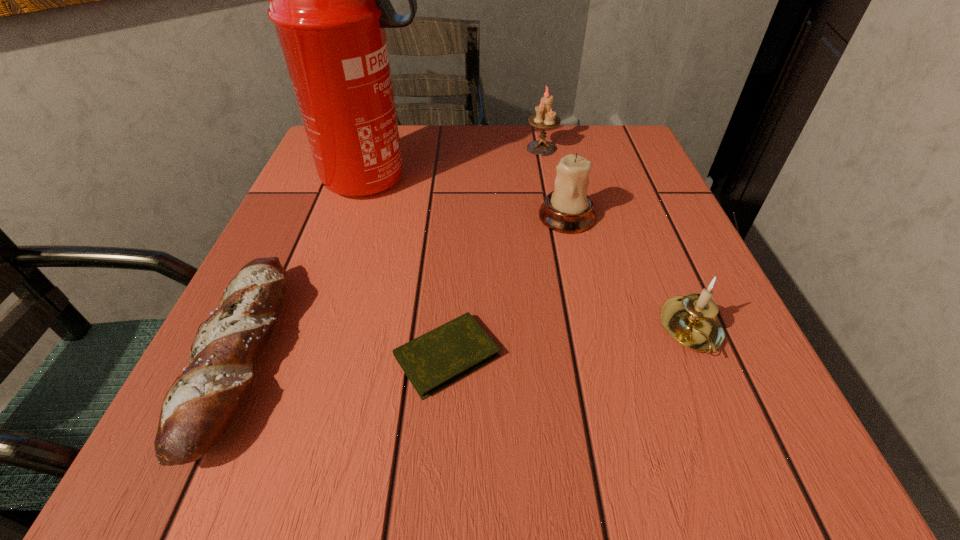
Identify the location of vacant space at the far edge. (511, 139).

Identify the location of blank area at the left edge. (342, 201).

Locate an element on the screen. This screenshot has width=960, height=540. vacant space at the right edge is located at coordinates (614, 178).

Locate an element on the screen. This screenshot has width=960, height=540. free space at the far right corner is located at coordinates (617, 129).

Where is `free space between the second shortest object and the second nearest candle holder`? The image size is (960, 540). free space between the second shortest object and the second nearest candle holder is located at coordinates (404, 286).

Find the location of a particular element. Image resolution: width=960 pixels, height=540 pixels. unoccupied position between the farthest candle holder and the shortest object is located at coordinates (494, 252).

This screenshot has height=540, width=960. I want to click on vacant area between the shortest candle holder and the tallest object, so click(534, 255).

Locate an element on the screen. vacant area between the farthest candle holder and the nearest candle holder is located at coordinates (616, 240).

The image size is (960, 540). What are the coordinates of `free space between the baguet and the second nearest candle holder` in the screenshot? It's located at (404, 286).

Where is `free spot between the baguet and the fire extinguisher`? This screenshot has width=960, height=540. free spot between the baguet and the fire extinguisher is located at coordinates (309, 268).